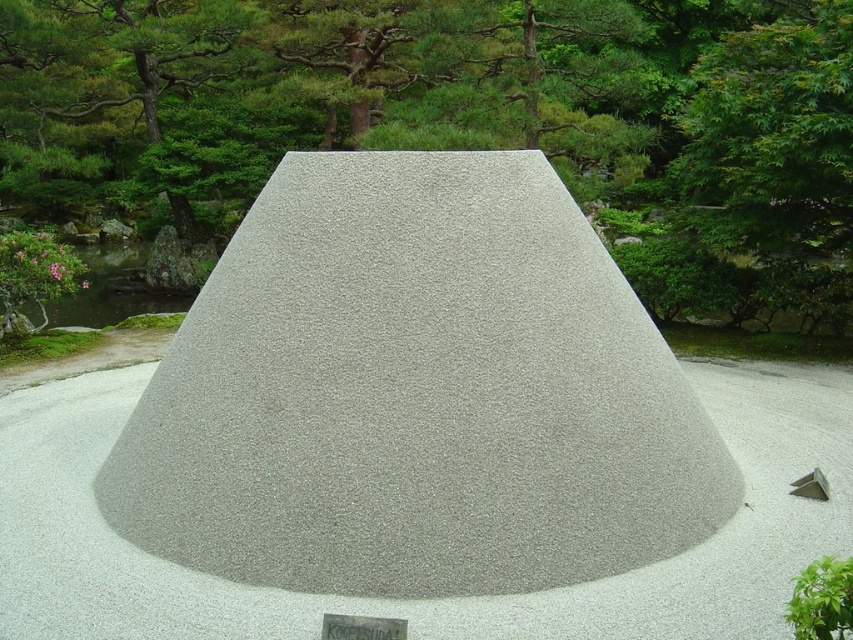
Question: Which object appears farthest from the camera in this image?

Choices:
 (A) green textured tree at center
 (B) gray gravel mound at center

Answer: (A)

Question: Is green textured tree at center positioned behind gray gravel mound at center?

Choices:
 (A) no
 (B) yes

Answer: (B)

Question: Can you confirm if green textured tree at center is positioned to the left of gray gravel mound at center?

Choices:
 (A) yes
 (B) no

Answer: (A)

Question: Which of the following is the farthest from the observer?

Choices:
 (A) green textured tree at center
 (B) gray gravel mound at center

Answer: (A)

Question: Which point is closer to the camera?

Choices:
 (A) (846, 544)
 (B) (518, 61)

Answer: (A)

Question: Is green textured tree at center thinner than gray gravel mound at center?

Choices:
 (A) yes
 (B) no

Answer: (B)